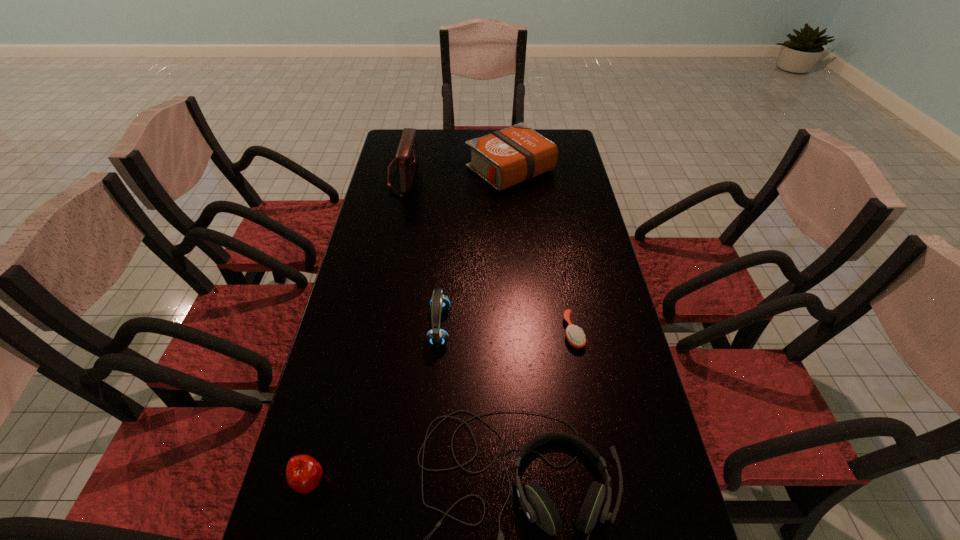
In the image, there is a desktop. Identify the location of vacant region at the right edge. This screenshot has width=960, height=540. (599, 426).

This screenshot has height=540, width=960. I want to click on vacant space at the far right corner, so click(x=564, y=130).

Image resolution: width=960 pixels, height=540 pixels. What are the coordinates of `free area in between the second shortest object and the hairbrush` in the screenshot? It's located at (442, 407).

What are the coordinates of `unoccupied position between the farther headset and the shortest object` in the screenshot? It's located at (507, 329).

The height and width of the screenshot is (540, 960). In order to click on free space between the shortest object and the Bible in this screenshot , I will do `click(541, 251)`.

The width and height of the screenshot is (960, 540). Find the location of `vacant space in between the farther headset and the hairbrush`. vacant space in between the farther headset and the hairbrush is located at coordinates (507, 329).

What are the coordinates of `vacant space that is in between the farther headset and the shortest object` in the screenshot? It's located at (507, 329).

At what (x,y) coordinates should I click in order to perform the action: click on free area in between the fifth tallest object and the hairbrush. Please return your answer as a coordinate pair (x, y). This screenshot has height=540, width=960. Looking at the image, I should click on (442, 407).

This screenshot has width=960, height=540. In order to click on object that is the second closest to the hairbrush in this screenshot , I will do `click(439, 302)`.

Identify which object is located as the third nearest to the second shortest object. Please provide its 2D coordinates. Your answer should be formatted as a tuple, i.e. [(x, y)], where the tuple contains the x and y coordinates of a point satisfying the conditions above.

[(575, 336)]